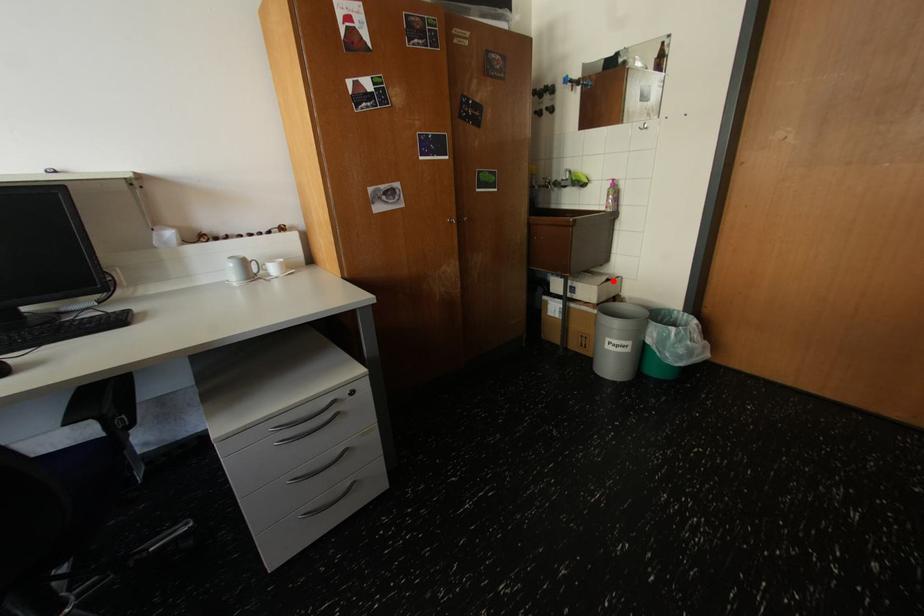
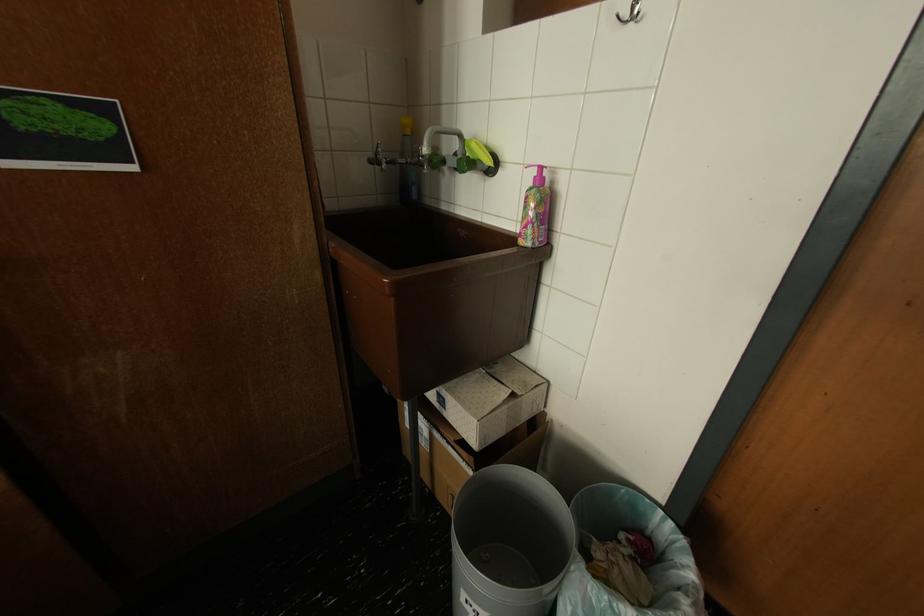
The point at the highlighted location is marked in the first image. Where is the corresponding point in the second image?

(508, 402)